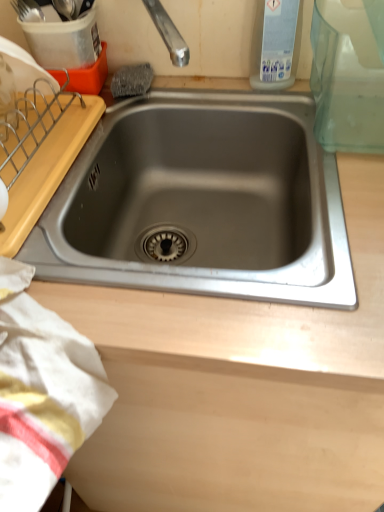
What do you see at coordinates (202, 202) in the screenshot? I see `stainless steel sink at center` at bounding box center [202, 202].

Locate an element on the screen. The height and width of the screenshot is (512, 384). white cotton towel at lower left is located at coordinates (42, 392).

Locate an element on the screen. The image size is (384, 512). transparent plastic bottle at upper right is located at coordinates (277, 48).

Can we say white cotton towel at lower left lies outside transparent plastic bottle at upper right?

Absolutely, white cotton towel at lower left is external to transparent plastic bottle at upper right.

From a real-world perspective, relative to transparent plastic bottle at upper right, is white cotton towel at lower left vertically above or below?

From a real-world perspective, white cotton towel at lower left is physically below transparent plastic bottle at upper right.

From the image's perspective, which is above, white cotton towel at lower left or transparent plastic bottle at upper right?

transparent plastic bottle at upper right, from the image's perspective.

Is white cotton towel at lower left oriented away from transparent plastic bottle at upper right?

No, white cotton towel at lower left is not facing the opposite direction of transparent plastic bottle at upper right.

From the image's perspective, does stainless steel sink at center appear lower than white cotton towel at lower left?

Actually, stainless steel sink at center appears above white cotton towel at lower left in the image.

Is white cotton towel at lower left at the back of stainless steel sink at center?

No, stainless steel sink at center is not facing the opposite direction of white cotton towel at lower left.

Who is taller, stainless steel sink at center or white cotton towel at lower left?

With more height is stainless steel sink at center.

Which object is thinner, stainless steel sink at center or white cotton towel at lower left?

With smaller width is white cotton towel at lower left.

Which object is positioned more to the left, transparent plastic bottle at upper right or white cotton towel at lower left?

Positioned to the left is white cotton towel at lower left.

From the picture: Is transparent plastic bottle at upper right positioned with its back to white cotton towel at lower left?

That's not correct — transparent plastic bottle at upper right is not looking away from white cotton towel at lower left.

Is transparent plastic bottle at upper right completely or partially outside of white cotton towel at lower left?

Absolutely, transparent plastic bottle at upper right is external to white cotton towel at lower left.

Is stainless steel sink at center positioned with its back to transparent plastic bottle at upper right?

No, transparent plastic bottle at upper right is not at the back of stainless steel sink at center.

From a real-world perspective, relative to transparent plastic bottle at upper right, is stainless steel sink at center vertically above or below?

From a real-world perspective, stainless steel sink at center is physically below transparent plastic bottle at upper right.

Which object is positioned more to the left, stainless steel sink at center or transparent plastic bottle at upper right?

From the viewer's perspective, stainless steel sink at center appears more on the left side.

In the image, there is a transparent plastic bottle at upper right. Where is `sink below it (from a real-world perspective)`? Image resolution: width=384 pixels, height=512 pixels. sink below it (from a real-world perspective) is located at coordinates click(202, 202).

Identify the location of sink behind the white cotton towel at lower left. This screenshot has height=512, width=384. (202, 202).

Is stainless steel sink at center inside white cotton towel at lower left?

No, white cotton towel at lower left does not contain stainless steel sink at center.

Would you consider white cotton towel at lower left to be distant from stainless steel sink at center?

white cotton towel at lower left is actually quite close to stainless steel sink at center.

Which is nearer, (45, 426) or (351, 274)?

Point (45, 426).

Which object is closer to the camera taking this photo, transparent plastic bottle at upper right or stainless steel sink at center?

Positioned in front is stainless steel sink at center.

Is transparent plastic bottle at upper right far from stainless steel sink at center?

No.

Which of these two, transparent plastic bottle at upper right or stainless steel sink at center, is smaller?

transparent plastic bottle at upper right.

Looking at this image, from the image's perspective, relative to stainless steel sink at center, is transparent plastic bottle at upper right above or below?

Based on their image positions, transparent plastic bottle at upper right is located above stainless steel sink at center.

The width and height of the screenshot is (384, 512). In the image, there is a white cotton towel at lower left. Identify the location of bottle above it (from the image's perspective). (277, 48).

The width and height of the screenshot is (384, 512). In order to click on blanket lying below the stainless steel sink at center (from the image's perspective) in this screenshot , I will do `click(42, 392)`.

Based on their spatial positions, is transparent plastic bottle at upper right or stainless steel sink at center further from white cotton towel at lower left?

Among the two, transparent plastic bottle at upper right is located further to white cotton towel at lower left.

When comparing their distances from stainless steel sink at center, does transparent plastic bottle at upper right or white cotton towel at lower left seem further?

white cotton towel at lower left is positioned further to the anchor stainless steel sink at center.

Based on their spatial positions, is stainless steel sink at center or transparent plastic bottle at upper right closer to white cotton towel at lower left?

stainless steel sink at center lies closer to white cotton towel at lower left than the other object.

From the image, which object appears to be nearer to transparent plastic bottle at upper right, white cotton towel at lower left or stainless steel sink at center?

stainless steel sink at center is closer to transparent plastic bottle at upper right.

From the image, which object appears to be farther from stainless steel sink at center, white cotton towel at lower left or transparent plastic bottle at upper right?

white cotton towel at lower left is positioned further to the anchor stainless steel sink at center.

Estimate the real-world distances between objects in this image. Which object is closer to transparent plastic bottle at upper right, stainless steel sink at center or white cotton towel at lower left?

stainless steel sink at center lies closer to transparent plastic bottle at upper right than the other object.

In order to click on sink between transparent plastic bottle at upper right and white cotton towel at lower left vertically in this screenshot , I will do `click(202, 202)`.